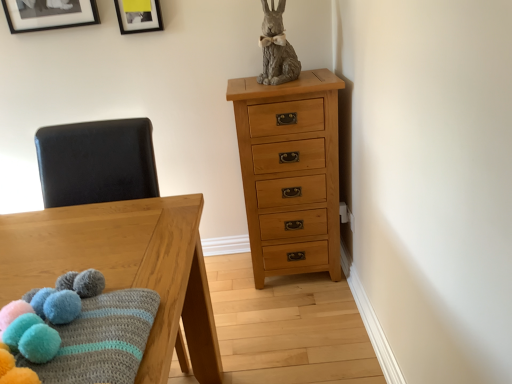
What is the approximate height of wooden table at left?

30.98 inches.

Describe the element at coordinates (96, 162) in the screenshot. I see `black leather swivel chair at left` at that location.

Where is `light brown wood chest of drawers at upper right`? The height and width of the screenshot is (384, 512). light brown wood chest of drawers at upper right is located at coordinates (290, 172).

Locate an element on the screen. The image size is (512, 384). black matte picture frame at upper center, placed as the 1th picture frame when sorted from right to left is located at coordinates (138, 16).

Between point (145, 17) and point (92, 22), which one is positioned behind?

The point (92, 22) is more distant.

Based on the photo, do you think black matte picture frame at upper center, placed as the 1th picture frame when sorted from right to left, is within black matte picture frame at upper left, acting as the first picture frame starting from the left, or outside of it?

black matte picture frame at upper center, placed as the 1th picture frame when sorted from right to left, is outside black matte picture frame at upper left, acting as the first picture frame starting from the left.

Based on the photo, is black matte picture frame at upper center, the second picture frame when ordered from left to right, next to black matte picture frame at upper left, acting as the first picture frame starting from the left?

No, black matte picture frame at upper center, the second picture frame when ordered from left to right, is not beside black matte picture frame at upper left, acting as the first picture frame starting from the left.

In terms of width, does black matte picture frame at upper center, the second picture frame when ordered from left to right, look wider or thinner when compared to black matte picture frame at upper left, acting as the first picture frame starting from the left?

Considering their sizes, black matte picture frame at upper center, the second picture frame when ordered from left to right, looks slimmer than black matte picture frame at upper left, acting as the first picture frame starting from the left.

Considering the sizes of objects black leather swivel chair at left and black matte picture frame at upper left, acting as the first picture frame starting from the left, in the image provided, who is bigger, black leather swivel chair at left or black matte picture frame at upper left, acting as the first picture frame starting from the left,?

With larger size is black leather swivel chair at left.

Is black leather swivel chair at left taller or shorter than black matte picture frame at upper left, placed as the second picture frame when sorted from right to left?

Considering their sizes, black leather swivel chair at left has more height than black matte picture frame at upper left, placed as the second picture frame when sorted from right to left.

Is black leather swivel chair at left facing away from black matte picture frame at upper left, acting as the first picture frame starting from the left?

No, black leather swivel chair at left is not facing away from black matte picture frame at upper left, acting as the first picture frame starting from the left.

Which is closer, (x=298, y=136) or (x=128, y=14)?

Positioned in front is point (x=298, y=136).

Between light brown wood chest of drawers at upper right and black matte picture frame at upper center, the second picture frame when ordered from left to right, which one appears on the right side from the viewer's perspective?

Positioned to the right is light brown wood chest of drawers at upper right.

Considering the sizes of objects light brown wood chest of drawers at upper right and black matte picture frame at upper center, the second picture frame when ordered from left to right, in the image provided, who is bigger, light brown wood chest of drawers at upper right or black matte picture frame at upper center, the second picture frame when ordered from left to right,?

light brown wood chest of drawers at upper right is bigger.

Can you tell me how much black matte picture frame at upper left, acting as the first picture frame starting from the left, and black matte picture frame at upper center, the second picture frame when ordered from left to right, differ in facing direction?

They differ by 0.000536 degrees in their facing directions.

Which object is wider, black matte picture frame at upper left, placed as the second picture frame when sorted from right to left, or black matte picture frame at upper center, placed as the 1th picture frame when sorted from right to left?

With larger width is black matte picture frame at upper left, placed as the second picture frame when sorted from right to left.

What are the coordinates of `picture frame on the left of the black matte picture frame at upper center, the second picture frame when ordered from left to right` in the screenshot? It's located at (49, 14).

Considering their positions, is black matte picture frame at upper center, placed as the 1th picture frame when sorted from right to left, located in front of or behind wooden table at left?

Visually, black matte picture frame at upper center, placed as the 1th picture frame when sorted from right to left, is located behind wooden table at left.

Which of these two, black matte picture frame at upper center, placed as the 1th picture frame when sorted from right to left, or wooden table at left, stands shorter?

black matte picture frame at upper center, placed as the 1th picture frame when sorted from right to left, is shorter.

From the wooden table at left, count 2nd picture frames backward and point to it. Please provide its 2D coordinates.

[(138, 16)]

In the scene shown: Is light brown wood chest of drawers at upper right completely or partially inside knitted woolen blanket with pom-poms at lower left?

Definitely not — light brown wood chest of drawers at upper right is not inside knitted woolen blanket with pom-poms at lower left.

Is knitted woolen blanket with pom-poms at lower left closer to the viewer compared to light brown wood chest of drawers at upper right?

That is True.

From the image's perspective, is knitted woolen blanket with pom-poms at lower left positioned above or below light brown wood chest of drawers at upper right?

Clearly, from the image's perspective, knitted woolen blanket with pom-poms at lower left is below light brown wood chest of drawers at upper right.

Considering the sizes of knitted woolen blanket with pom-poms at lower left and light brown wood chest of drawers at upper right in the image, is knitted woolen blanket with pom-poms at lower left wider or thinner than light brown wood chest of drawers at upper right?

In the image, knitted woolen blanket with pom-poms at lower left appears to be more narrow than light brown wood chest of drawers at upper right.

Is light brown wood chest of drawers at upper right turned away from knitted woolen blanket with pom-poms at lower left?

light brown wood chest of drawers at upper right does not have its back to knitted woolen blanket with pom-poms at lower left.

Does light brown wood chest of drawers at upper right come behind knitted woolen blanket with pom-poms at lower left?

That is True.

Do you think light brown wood chest of drawers at upper right is within knitted woolen blanket with pom-poms at lower left, or outside of it?

light brown wood chest of drawers at upper right is not inside knitted woolen blanket with pom-poms at lower left, it's outside.

What's the angular difference between light brown wood chest of drawers at upper right and knitted woolen blanket with pom-poms at lower left's facing directions?

light brown wood chest of drawers at upper right and knitted woolen blanket with pom-poms at lower left are facing 179 degrees away from each other.

This screenshot has height=384, width=512. Identify the location of picture frame located behind the black matte picture frame at upper left, acting as the first picture frame starting from the left. (138, 16).

You are a GUI agent. You are given a task and a screenshot of the screen. Output one action in this format:
    pyautogui.click(x=<x>, y=<y>)
    Task: Click on the swivel chair in front of the black matte picture frame at upper left, acting as the first picture frame starting from the left
    The width and height of the screenshot is (512, 384).
    Given the screenshot: What is the action you would take?
    pyautogui.click(x=96, y=162)

Which object lies nearer to the anchor point black matte picture frame at upper center, the second picture frame when ordered from left to right, knitted woolen blanket with pom-poms at lower left or light brown wood chest of drawers at upper right?

light brown wood chest of drawers at upper right is closer to black matte picture frame at upper center, the second picture frame when ordered from left to right.

Looking at the image, which one is located further to wooden table at left, knitted woolen blanket with pom-poms at lower left or light brown wood chest of drawers at upper right?

The object further to wooden table at left is light brown wood chest of drawers at upper right.

Based on the photo, looking at the image, which one is located closer to light brown wood chest of drawers at upper right, knitted woolen blanket with pom-poms at lower left or black matte picture frame at upper center, placed as the 1th picture frame when sorted from right to left?

Based on the image, black matte picture frame at upper center, placed as the 1th picture frame when sorted from right to left, appears to be nearer to light brown wood chest of drawers at upper right.

Based on their spatial positions, is light brown wood chest of drawers at upper right or black matte picture frame at upper center, the second picture frame when ordered from left to right, further from black leather swivel chair at left?

Based on the image, black matte picture frame at upper center, the second picture frame when ordered from left to right, appears to be further to black leather swivel chair at left.

Estimate the real-world distances between objects in this image. Which object is further from wooden table at left, knitted woolen blanket with pom-poms at lower left or black leather swivel chair at left?

knitted woolen blanket with pom-poms at lower left lies further to wooden table at left than the other object.

Considering their positions, is black matte picture frame at upper center, the second picture frame when ordered from left to right, positioned further to black leather swivel chair at left than knitted woolen blanket with pom-poms at lower left?

The object further to black leather swivel chair at left is black matte picture frame at upper center, the second picture frame when ordered from left to right.

Based on their spatial positions, is wooden table at left or light brown wood chest of drawers at upper right closer to black leather swivel chair at left?

wooden table at left is closer to black leather swivel chair at left.

Which object lies nearer to the anchor point knitted woolen blanket with pom-poms at lower left, light brown wood chest of drawers at upper right or wooden table at left?

The object closer to knitted woolen blanket with pom-poms at lower left is wooden table at left.

Identify the location of table between knitted woolen blanket with pom-poms at lower left and light brown wood chest of drawers at upper right from front to back. Image resolution: width=512 pixels, height=384 pixels. (125, 268).

Where is `swivel chair between knitted woolen blanket with pom-poms at lower left and black matte picture frame at upper left, placed as the second picture frame when sorted from right to left, in the front-back direction`? swivel chair between knitted woolen blanket with pom-poms at lower left and black matte picture frame at upper left, placed as the second picture frame when sorted from right to left, in the front-back direction is located at coordinates (96, 162).

In order to click on picture frame between black matte picture frame at upper left, acting as the first picture frame starting from the left, and wooden table at left in the up-down direction in this screenshot , I will do `click(138, 16)`.

You are a GUI agent. You are given a task and a screenshot of the screen. Output one action in this format:
    pyautogui.click(x=<x>, y=<y>)
    Task: Click on the chest of drawers between black matte picture frame at upper center, placed as the 1th picture frame when sorted from right to left, and wooden table at left from top to bottom
    This screenshot has height=384, width=512.
    Given the screenshot: What is the action you would take?
    (290, 172)